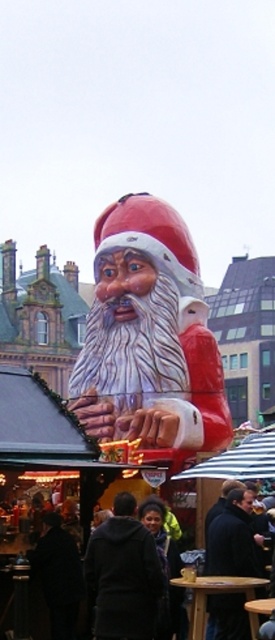
Between matte red santa claus at center and black matte jacket at center, which one has less height?

With less height is black matte jacket at center.

Does point (89, 356) come behind point (127, 493)?

Yes, it is behind point (127, 493).

Image resolution: width=275 pixels, height=640 pixels. Identify the location of matte red santa claus at center. (149, 336).

Is black matte jacket at center bigger than dark brown leather jacket at center?

No.

Who is more distant from viewer, (108, 588) or (256, 568)?

The point (256, 568) is more distant.

This screenshot has width=275, height=640. I want to click on black matte jacket at center, so click(x=122, y=576).

Image resolution: width=275 pixels, height=640 pixels. Describe the element at coordinates (149, 336) in the screenshot. I see `matte red santa claus at center` at that location.

The height and width of the screenshot is (640, 275). I want to click on matte red santa claus at center, so click(149, 336).

Describe the element at coordinates (149, 336) in the screenshot. I see `matte red santa claus at center` at that location.

The height and width of the screenshot is (640, 275). What are the coordinates of `matte red santa claus at center` in the screenshot? It's located at (149, 336).